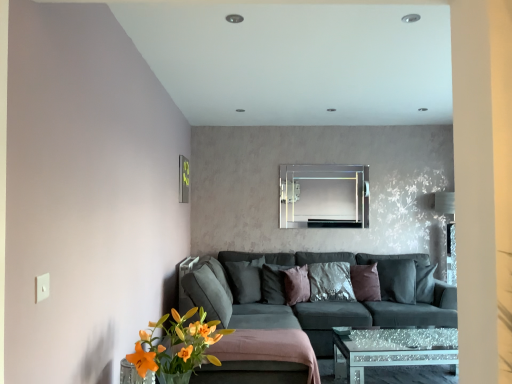
Where is `blank space situated above clear glass mirror at center (from a real-world perspective)`? The height and width of the screenshot is (384, 512). blank space situated above clear glass mirror at center (from a real-world perspective) is located at coordinates (326, 158).